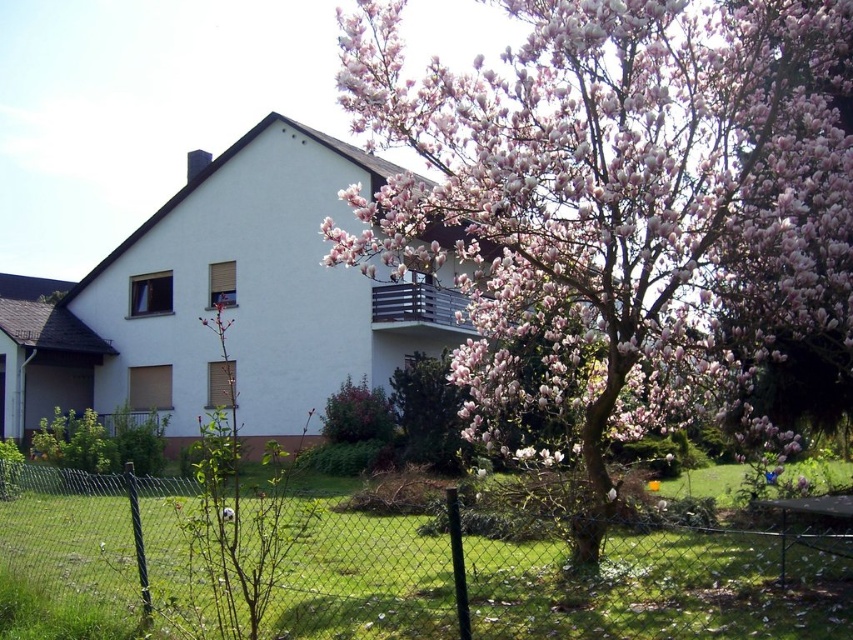
Between pink blossoming tree at center and black metal balcony at upper center, which one appears on the left side from the viewer's perspective?

From the viewer's perspective, black metal balcony at upper center appears more on the left side.

Can you confirm if pink blossoming tree at center is smaller than black metal balcony at upper center?

Yes, pink blossoming tree at center is smaller than black metal balcony at upper center.

What are the coordinates of `pink blossoming tree at center` in the screenshot? It's located at (621, 211).

The height and width of the screenshot is (640, 853). I want to click on green chain-link fence at lower center, so click(x=401, y=568).

Which of these two, green chain-link fence at lower center or black metal balcony at upper center, stands shorter?

black metal balcony at upper center is shorter.

Is point (718, 630) closer to viewer compared to point (463, 301)?

Yes, point (718, 630) is in front of point (463, 301).

The width and height of the screenshot is (853, 640). Find the location of `green chain-link fence at lower center`. green chain-link fence at lower center is located at coordinates (401, 568).

Does pink blossoming tree at center appear under green chain-link fence at lower center?

No.

Is point (567, 136) farther from camera compared to point (277, 636)?

No, it is not.

Is point (750, 10) behind point (25, 492)?

No, (750, 10) is in front of (25, 492).

Locate an element on the screen. pink blossoming tree at center is located at coordinates (621, 211).